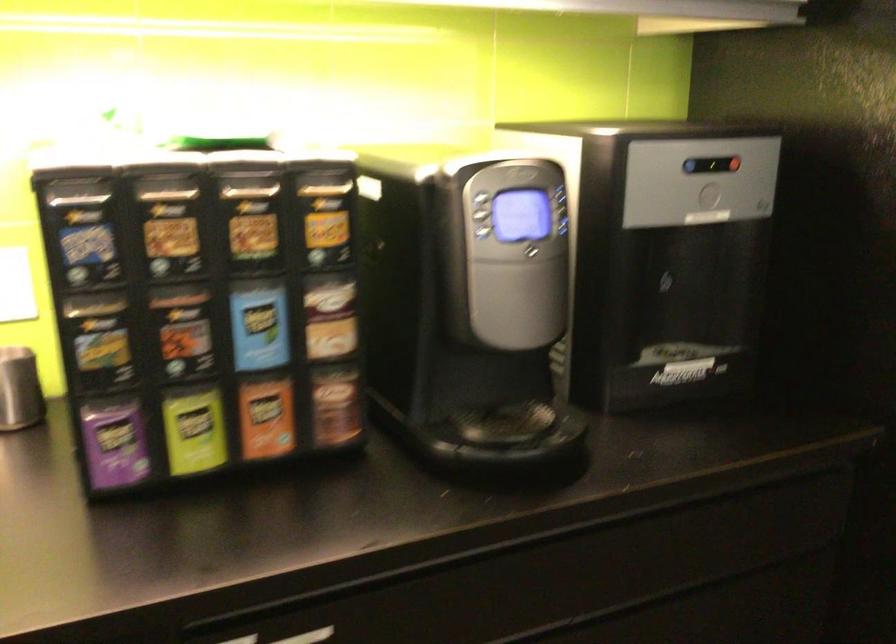
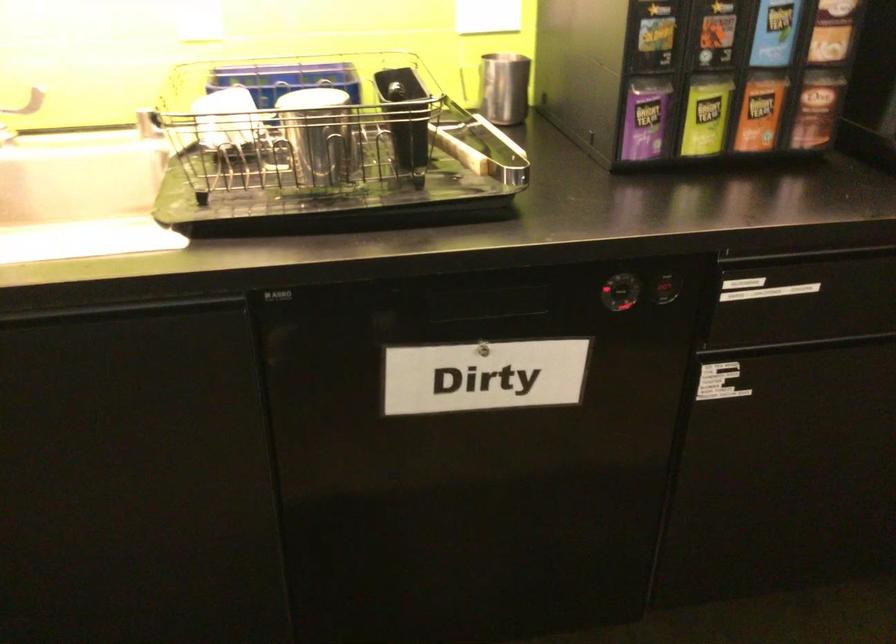
Where in the second image is the point corresponding to pixel 116 440 from the first image?

(645, 118)